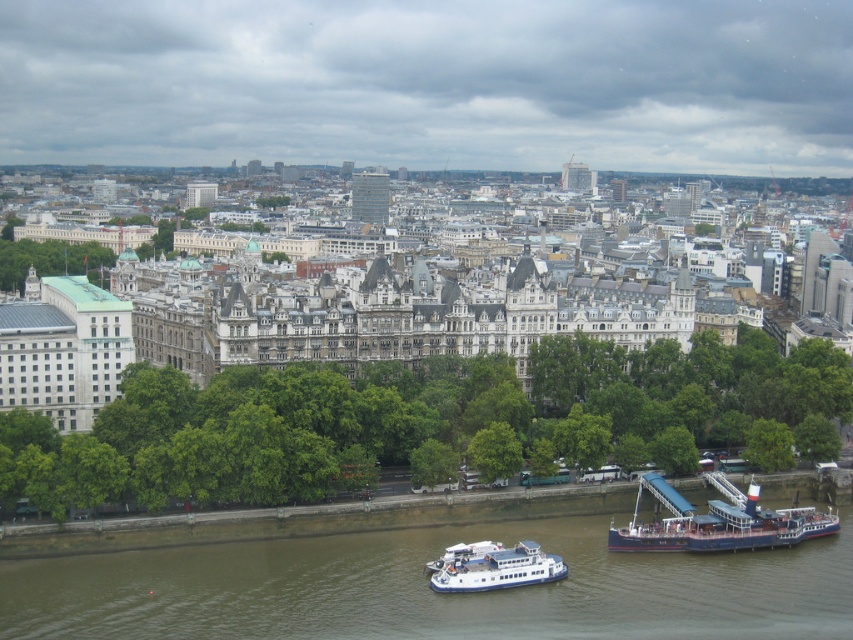
Does green leafy trees at center lie in front of blue polished wood boat at lower right?

Yes, green leafy trees at center is in front of blue polished wood boat at lower right.

Measure the distance between green leafy trees at center and blue polished wood boat at lower right.

green leafy trees at center is 65.43 feet from blue polished wood boat at lower right.

Does point (566, 352) come farther from viewer compared to point (743, 529)?

Yes, it is behind point (743, 529).

Locate an element on the screen. This screenshot has height=640, width=853. green leafy trees at center is located at coordinates (410, 420).

Is blue polished wood boat at lower right to the left of green leafy tree at left from the viewer's perspective?

In fact, blue polished wood boat at lower right is to the right of green leafy tree at left.

Which is in front, point (672, 518) or point (42, 244)?

Point (672, 518) is more forward.

This screenshot has height=640, width=853. What do you see at coordinates (717, 522) in the screenshot?
I see `blue polished wood boat at lower right` at bounding box center [717, 522].

Find the location of `blue polished wood boat at lower right`. blue polished wood boat at lower right is located at coordinates click(x=717, y=522).

In order to click on green leafy trees at center in this screenshot , I will do `click(410, 420)`.

Is green leafy trees at center wider than white glossy ferry at lower center?

Indeed, green leafy trees at center has a greater width compared to white glossy ferry at lower center.

Where is `green leafy trees at center`? This screenshot has width=853, height=640. green leafy trees at center is located at coordinates (410, 420).